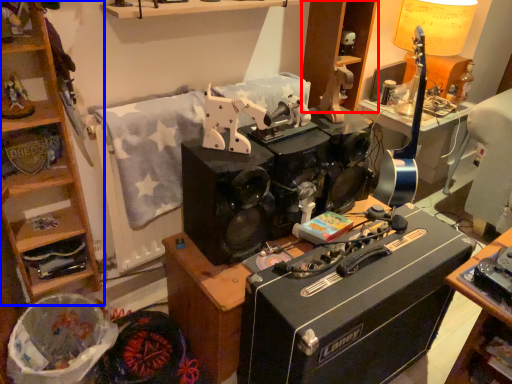
Question: Which object appears farthest to the camera in this image, cabinetry (highlighted by a red box) or cabinetry (highlighted by a blue box)?

Choices:
 (A) cabinetry
 (B) cabinetry

Answer: (A)